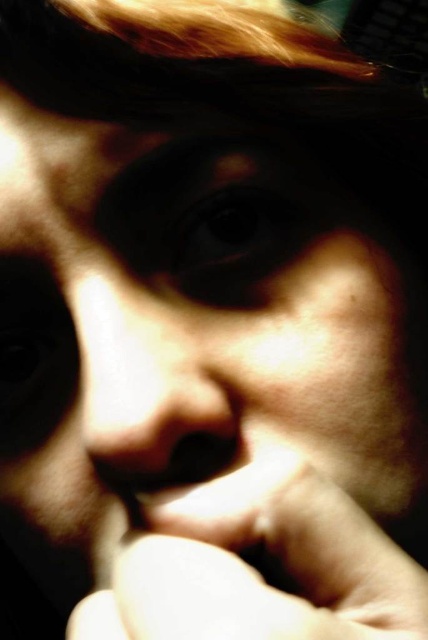
Which is above, smooth skin hand at center or smooth skin nose at center?

smooth skin nose at center is higher up.

Looking at this image, does smooth skin hand at center have a lesser width compared to smooth skin nose at center?

In fact, smooth skin hand at center might be wider than smooth skin nose at center.

This screenshot has width=428, height=640. What do you see at coordinates (255, 570) in the screenshot?
I see `smooth skin hand at center` at bounding box center [255, 570].

The width and height of the screenshot is (428, 640). Identify the location of smooth skin hand at center. (255, 570).